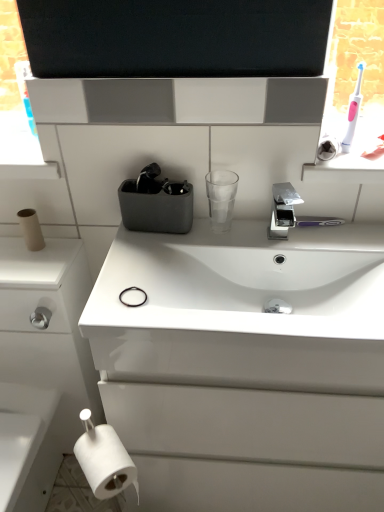
Measure the distance between point [277,197] and camera.

The depth of point [277,197] is 1.05 meters.

What do you see at coordinates (221, 198) in the screenshot? Image resolution: width=384 pixels, height=512 pixels. I see `transparent plastic cup at center` at bounding box center [221, 198].

What do you see at coordinates (353, 110) in the screenshot? I see `pink plastic toothbrush at upper right` at bounding box center [353, 110].

Where is `chrome metallic faucet at center`? The height and width of the screenshot is (512, 384). chrome metallic faucet at center is located at coordinates pos(283,210).

Are transparent plastic cup at center and pink plastic toothbrush at upper right far apart?

Actually, transparent plastic cup at center and pink plastic toothbrush at upper right are a little close together.

From the image's perspective, between transparent plastic cup at center and pink plastic toothbrush at upper right, which one is located above?

pink plastic toothbrush at upper right.

Is the depth of transparent plastic cup at center greater than that of pink plastic toothbrush at upper right?

Yes.

In the scene shown: Between chrome metallic faucet at center and white glossy cabinet at lower left, which one has more height?

white glossy cabinet at lower left is taller.

In the image, is chrome metallic faucet at center on the left side or the right side of white glossy cabinet at lower left?

chrome metallic faucet at center is to the right of white glossy cabinet at lower left.

Is chrome metallic faucet at center inside or outside of white glossy cabinet at lower left?

chrome metallic faucet at center lies outside white glossy cabinet at lower left.

From a real-world perspective, is chrome metallic faucet at center positioned under white glossy cabinet at lower left based on gravity?

No, from a real-world perspective, chrome metallic faucet at center is not below white glossy cabinet at lower left.

From the image's perspective, is white glossy cabinet at lower left located beneath pink plastic toothbrush at upper right?

Indeed, from the image's perspective, white glossy cabinet at lower left is shown beneath pink plastic toothbrush at upper right.

How many degrees apart are the facing directions of white glossy cabinet at lower left and pink plastic toothbrush at upper right?

The angular difference between white glossy cabinet at lower left and pink plastic toothbrush at upper right is 0.289 degrees.

From a real-world perspective, is white glossy cabinet at lower left under pink plastic toothbrush at upper right?

Yes, from a real-world perspective, white glossy cabinet at lower left is under pink plastic toothbrush at upper right.

Choose the correct answer: Is white glossy cabinet at lower left inside pink plastic toothbrush at upper right or outside it?

white glossy cabinet at lower left is outside pink plastic toothbrush at upper right.

Between point (129, 464) and point (47, 492), which one is positioned behind?

The point (47, 492) is more distant.

Could you tell me if white matte toilet paper at lower left, placed as the second toilet paper when sorted from back to front, is facing white glossy cabinet at lower left?

No, white matte toilet paper at lower left, placed as the second toilet paper when sorted from back to front, is not facing towards white glossy cabinet at lower left.

Is there a large distance between white matte toilet paper at lower left, which is the first toilet paper from bottom to top, and white glossy cabinet at lower left?

white matte toilet paper at lower left, which is the first toilet paper from bottom to top, is near white glossy cabinet at lower left, not far away.

Considering the relative sizes of white matte toilet paper at lower left, placed as the second toilet paper when sorted from back to front, and white glossy cabinet at lower left in the image provided, is white matte toilet paper at lower left, placed as the second toilet paper when sorted from back to front, thinner than white glossy cabinet at lower left?

Yes.

Locate an element on the screen. The image size is (384, 512). toothbrush above the white cardboard toilet paper at left, marked as the first toilet paper in a top-to-bottom arrangement (from a real-world perspective) is located at coordinates (353, 110).

How different are the orientations of pink plastic toothbrush at upper right and white cardboard toilet paper at left, arranged as the second toilet paper when ordered from the bottom, in degrees?

The angular difference between pink plastic toothbrush at upper right and white cardboard toilet paper at left, arranged as the second toilet paper when ordered from the bottom, is 0.502 degrees.

Is point (360, 88) closer or farther from the camera than point (28, 216)?

Clearly, point (360, 88) is closer to the camera than point (28, 216).

Is white cardboard toilet paper at left, which appears as the 1th toilet paper when viewed from the back, at the back of pink plastic toothbrush at upper right?

No, white cardboard toilet paper at left, which appears as the 1th toilet paper when viewed from the back, is not at the back of pink plastic toothbrush at upper right.

Considering the relative positions of pink plastic toothbrush at upper right and transparent plastic cup at center in the image provided, is pink plastic toothbrush at upper right to the left of transparent plastic cup at center from the viewer's perspective?

In fact, pink plastic toothbrush at upper right is to the right of transparent plastic cup at center.

Can you confirm if pink plastic toothbrush at upper right is wider than transparent plastic cup at center?

Incorrect, the width of pink plastic toothbrush at upper right does not surpass that of transparent plastic cup at center.

Measure the distance from pink plastic toothbrush at upper right to transparent plastic cup at center.

A distance of 32.23 centimeters exists between pink plastic toothbrush at upper right and transparent plastic cup at center.

Is pink plastic toothbrush at upper right next to transparent plastic cup at center?

pink plastic toothbrush at upper right is not next to transparent plastic cup at center, and they're not touching.

In terms of width, does white cardboard toilet paper at left, positioned as the second toilet paper in right-to-left order, look wider or thinner when compared to pink plastic toothbrush at upper right?

white cardboard toilet paper at left, positioned as the second toilet paper in right-to-left order, is wider than pink plastic toothbrush at upper right.

From a real-world perspective, which is physically above, white cardboard toilet paper at left, arranged as the second toilet paper when ordered from the bottom, or pink plastic toothbrush at upper right?

pink plastic toothbrush at upper right.

From the image's perspective, is white cardboard toilet paper at left, arranged as the second toilet paper when ordered from the bottom, beneath pink plastic toothbrush at upper right?

Indeed, from the image's perspective, white cardboard toilet paper at left, arranged as the second toilet paper when ordered from the bottom, is shown beneath pink plastic toothbrush at upper right.

From the picture: Is white cardboard toilet paper at left, marked as the first toilet paper in a top-to-bottom arrangement, situated inside pink plastic toothbrush at upper right or outside?

white cardboard toilet paper at left, marked as the first toilet paper in a top-to-bottom arrangement, is not enclosed by pink plastic toothbrush at upper right.

Where is `toothbrush above the transparent plastic cup at center (from the image's perspective)`? toothbrush above the transparent plastic cup at center (from the image's perspective) is located at coordinates (353, 110).

This screenshot has width=384, height=512. What are the coordinates of `tap that is on the right side of white glossy cabinet at lower left` in the screenshot? It's located at (283, 210).

Estimate the real-world distances between objects in this image. Which object is further from transparent plastic cup at center, white cardboard toilet paper at left, which appears as the 1th toilet paper when viewed from the back, or white glossy cabinet at lower left?

white glossy cabinet at lower left.

Looking at the image, which one is located further to white cardboard toilet paper at left, placed as the 2th toilet paper when sorted from front to back, chrome metallic faucet at center or white matte toilet paper at lower left, placed as the second toilet paper when sorted from back to front?

Among the two, chrome metallic faucet at center is located further to white cardboard toilet paper at left, placed as the 2th toilet paper when sorted from front to back.

Estimate the real-world distances between objects in this image. Which object is closer to chrome metallic faucet at center, white cardboard toilet paper at left, placed as the 2th toilet paper when sorted from front to back, or white glossy cabinet at lower left?

white cardboard toilet paper at left, placed as the 2th toilet paper when sorted from front to back.

From the image, which object appears to be farther from white glossy cabinet at lower left, pink plastic toothbrush at upper right or transparent plastic cup at center?

Based on the image, pink plastic toothbrush at upper right appears to be further to white glossy cabinet at lower left.

Looking at the image, which one is located closer to white matte toilet paper at lower left, placed as the second toilet paper when sorted from left to right, white cardboard toilet paper at left, which appears as the 1th toilet paper when viewed from the back, or transparent plastic cup at center?

Based on the image, white cardboard toilet paper at left, which appears as the 1th toilet paper when viewed from the back, appears to be nearer to white matte toilet paper at lower left, placed as the second toilet paper when sorted from left to right.

Based on their spatial positions, is white glossy cabinet at lower left or transparent plastic cup at center closer to chrome metallic faucet at center?

Based on the image, transparent plastic cup at center appears to be nearer to chrome metallic faucet at center.

Looking at the image, which one is located closer to white glossy cabinet at lower left, pink plastic toothbrush at upper right or chrome metallic faucet at center?

Among the two, chrome metallic faucet at center is located nearer to white glossy cabinet at lower left.

Considering their positions, is chrome metallic faucet at center positioned further to pink plastic toothbrush at upper right than white cardboard toilet paper at left, marked as the first toilet paper in a top-to-bottom arrangement?

white cardboard toilet paper at left, marked as the first toilet paper in a top-to-bottom arrangement.

Where is `cup between pink plastic toothbrush at upper right and white matte toilet paper at lower left, which is the 1th toilet paper from front to back, vertically`? cup between pink plastic toothbrush at upper right and white matte toilet paper at lower left, which is the 1th toilet paper from front to back, vertically is located at coordinates (221, 198).

Find the location of a particular element. cup located between white glossy cabinet at lower left and chrome metallic faucet at center in the left-right direction is located at coordinates (221, 198).

Locate an element on the screen. This screenshot has height=512, width=384. bathroom cabinet between white cardboard toilet paper at left, arranged as the second toilet paper when ordered from the bottom, and white matte toilet paper at lower left, which is the first toilet paper from bottom to top, in the up-down direction is located at coordinates (46, 346).

In order to click on tap situated between white glossy cabinet at lower left and pink plastic toothbrush at upper right from left to right in this screenshot , I will do `click(283, 210)`.